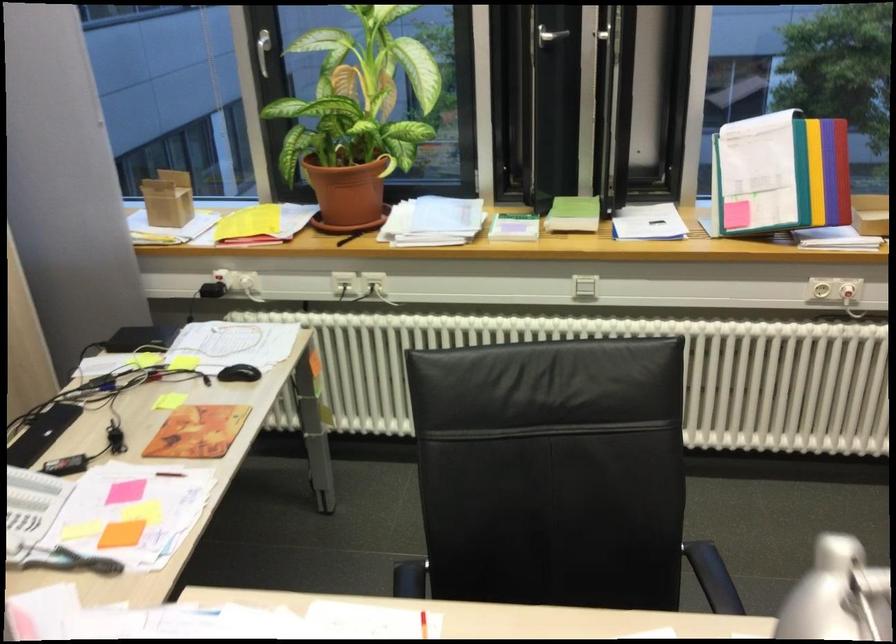
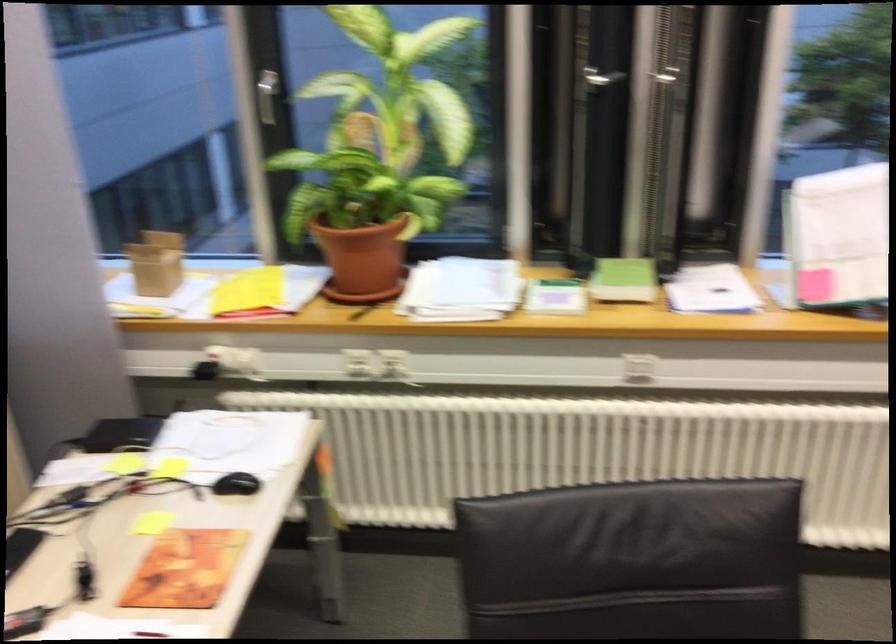
Question: How did the camera likely rotate?

Choices:
 (A) Left
 (B) Right
 (C) Up
 (D) Down

Answer: (C)